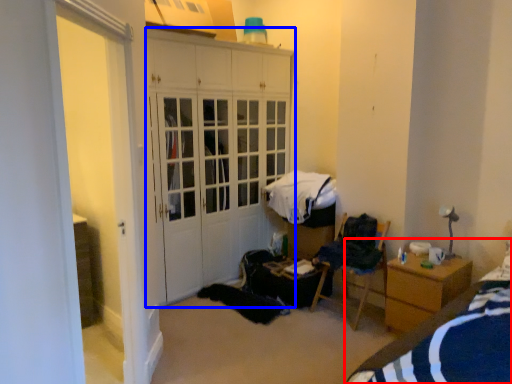
Question: Which of the following is the farthest to the observer, bed (highlighted by a red box) or cabinetry (highlighted by a blue box)?

Choices:
 (A) bed
 (B) cabinetry

Answer: (B)